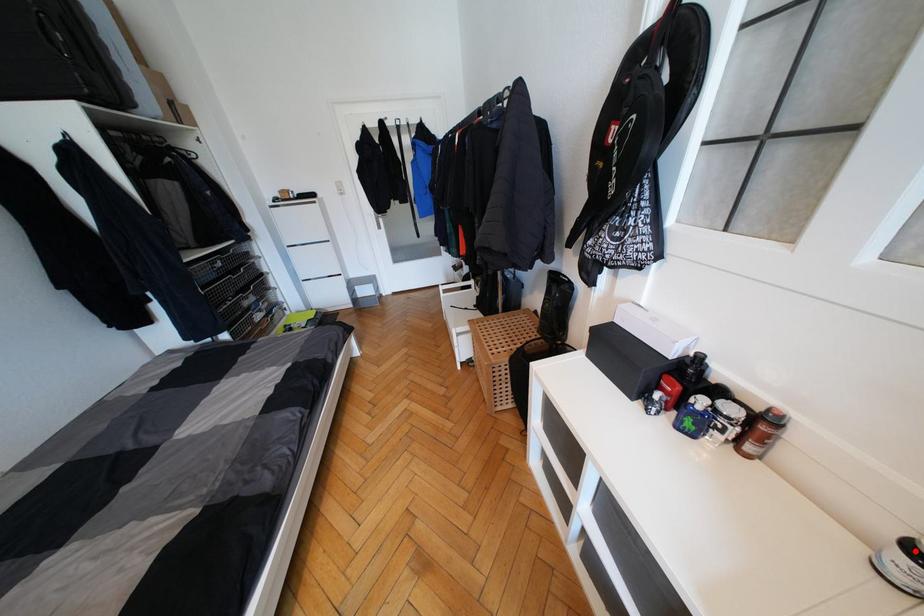
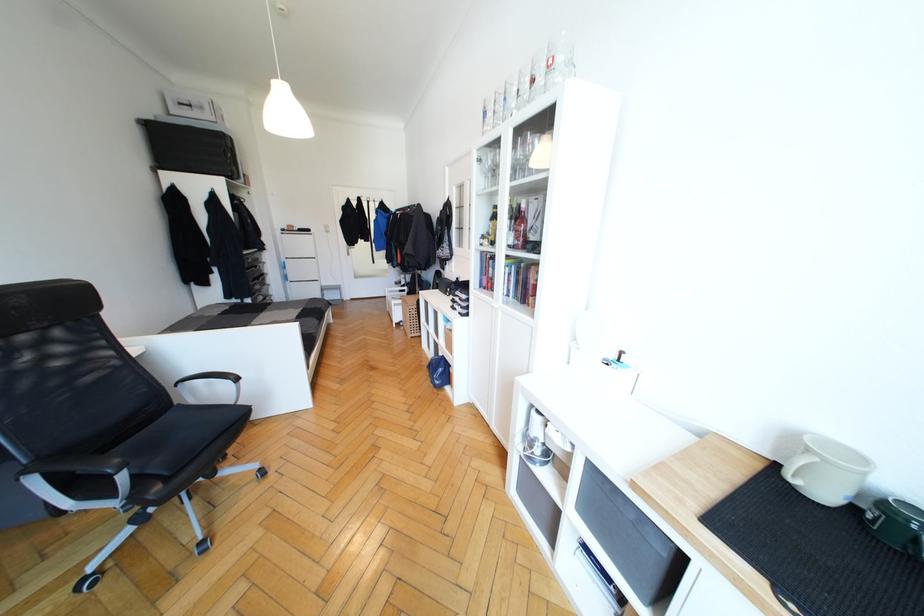
Question: I am providing you with two images of the same scene from different viewpoints. A red point is marked on the first image. At the location where the point appears in image 1, is it still visible in image 2?

Choices:
 (A) Yes
 (B) No

Answer: (B)